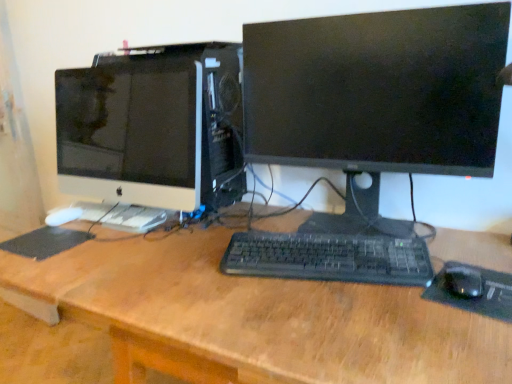
Find the location of a particular element. free spot in front of black plastic keyboard at center is located at coordinates (347, 317).